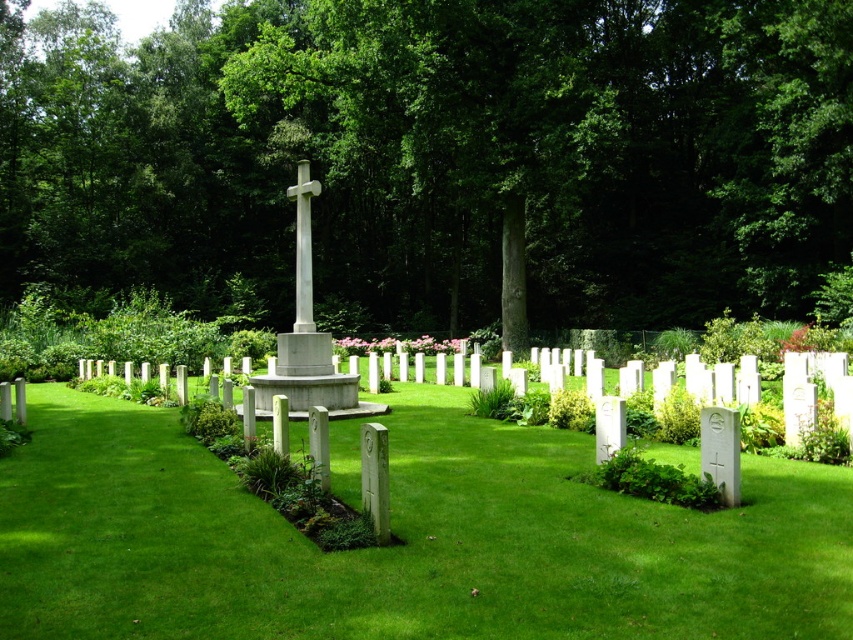
Question: Where is gray stone cross at center located in relation to white marble cross at center in the image?

Choices:
 (A) left
 (B) right

Answer: (B)

Question: Can you confirm if green grass at center is positioned to the right of gray stone cross at center?

Choices:
 (A) yes
 (B) no

Answer: (A)

Question: Which point is farther from the camera taking this photo?

Choices:
 (A) (265, 401)
 (B) (788, 561)

Answer: (A)

Question: Can you confirm if green grass at center is wider than white marble cross at center?

Choices:
 (A) yes
 (B) no

Answer: (A)

Question: Estimate the real-world distances between objects in this image. Which object is farther from the white marble cross at center?

Choices:
 (A) gray stone cross at center
 (B) green grass at center

Answer: (B)

Question: Which of these objects is positioned closest to the gray stone cross at center?

Choices:
 (A) green grass at center
 (B) white marble cross at center

Answer: (B)